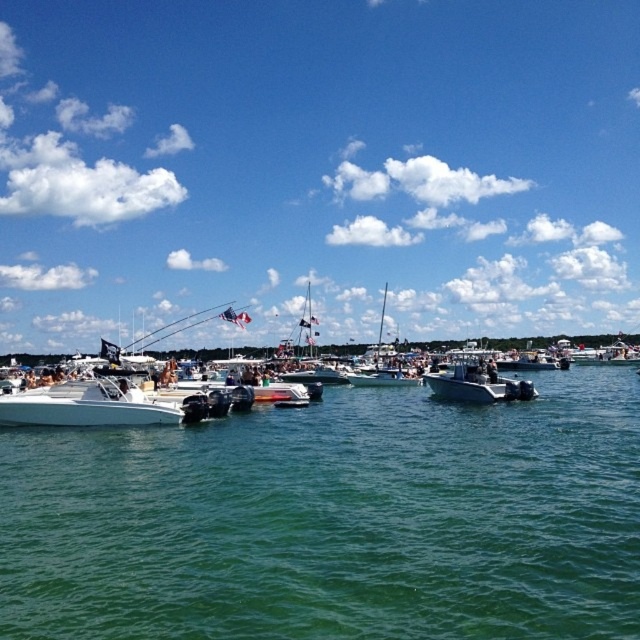
Does white glossy motorboat at center have a lesser height compared to white glossy sailboat at center?

Yes.

I want to click on white glossy motorboat at center, so click(88, 404).

Does point (156, 410) come closer to viewer compared to point (330, 372)?

Yes, point (156, 410) is closer to viewer.

The width and height of the screenshot is (640, 640). I want to click on white glossy motorboat at center, so click(x=88, y=404).

Is green smooth water at center shorter than white glossy motorboat at center?

Yes.

Who is positioned more to the left, green smooth water at center or white glossy motorboat at center?

white glossy motorboat at center

Who is more forward, (576,403) or (147,397)?

Point (147,397) is in front.

Image resolution: width=640 pixels, height=640 pixels. Find the location of `green smooth water at center`. green smooth water at center is located at coordinates (333, 518).

Can you confirm if transparent blue sky at upper center is bigger than white glossy motorboat at center?

Indeed, transparent blue sky at upper center has a larger size compared to white glossy motorboat at center.

Can you confirm if transparent blue sky at upper center is positioned to the left of white glossy motorboat at center?

Incorrect, transparent blue sky at upper center is not on the left side of white glossy motorboat at center.

Who is more forward, (x=243, y=163) or (x=179, y=404)?

Point (x=179, y=404)

Where is `transparent blue sky at upper center`? transparent blue sky at upper center is located at coordinates (317, 168).